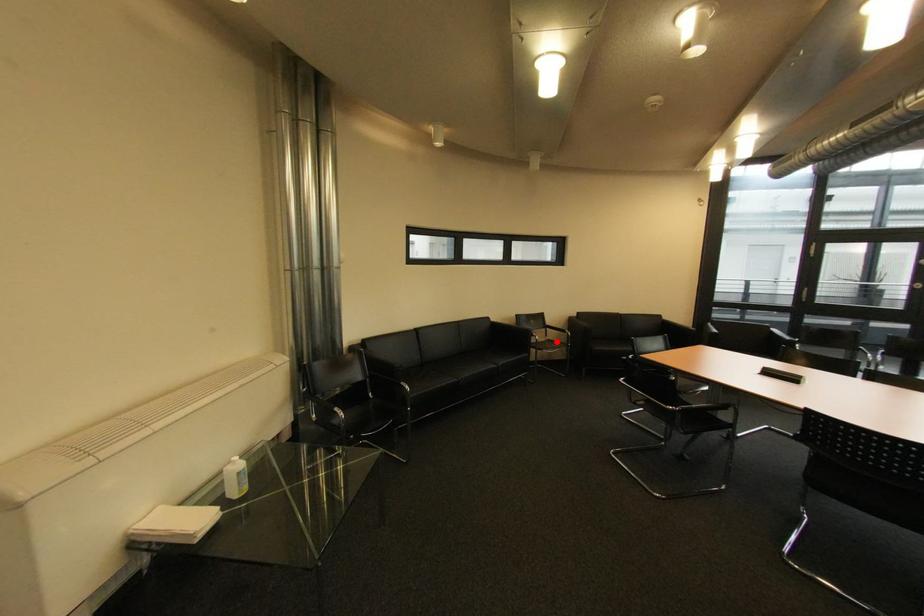
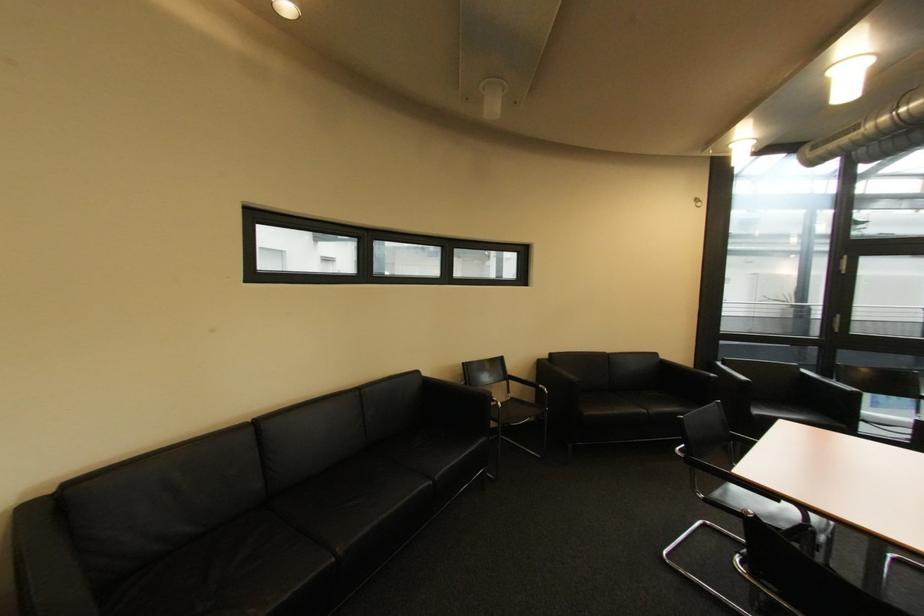
The point at the highlighted location is marked in the first image. Where is the corresponding point in the second image?

(520, 400)